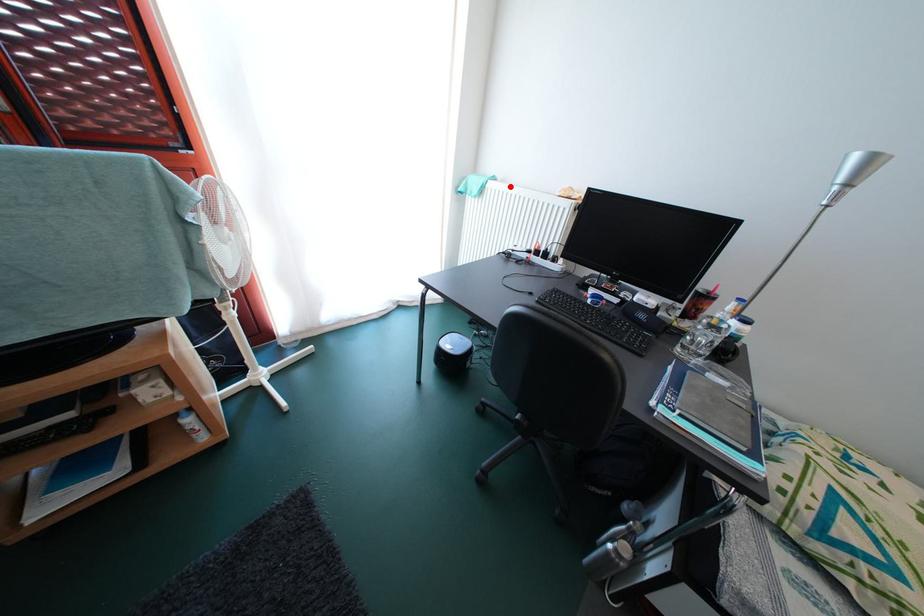
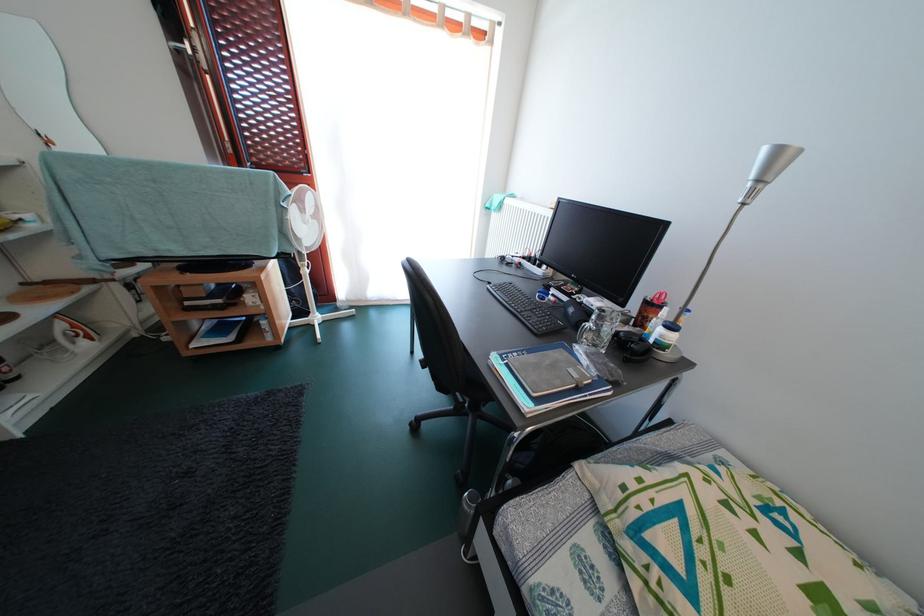
Question: I am providing you with two images of the same scene from different viewpoints. Image1 has a red point marked. In image2, the corresponding 3D location appears at what relative position? Reply with the corresponding letter.

Choices:
 (A) Closer
 (B) Farther

Answer: (A)